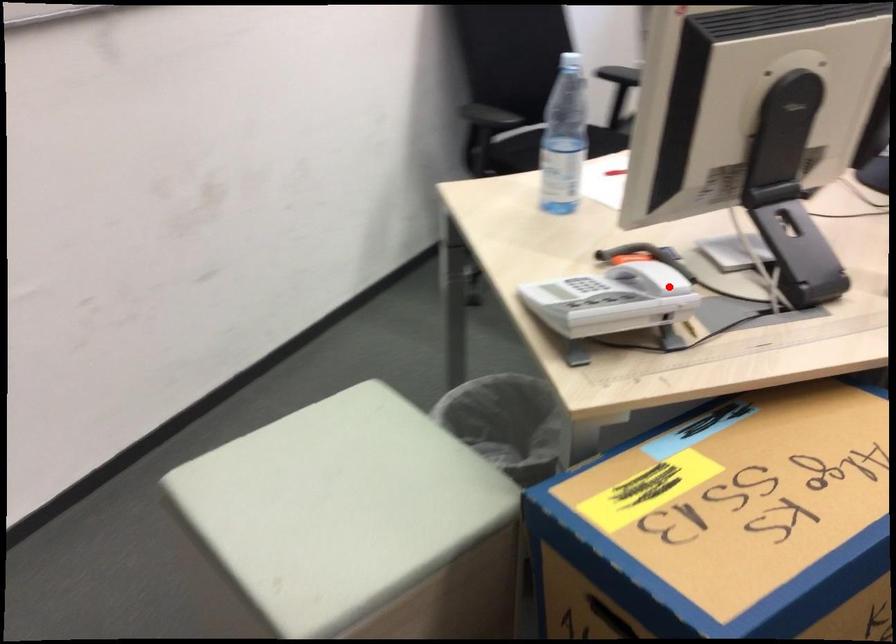
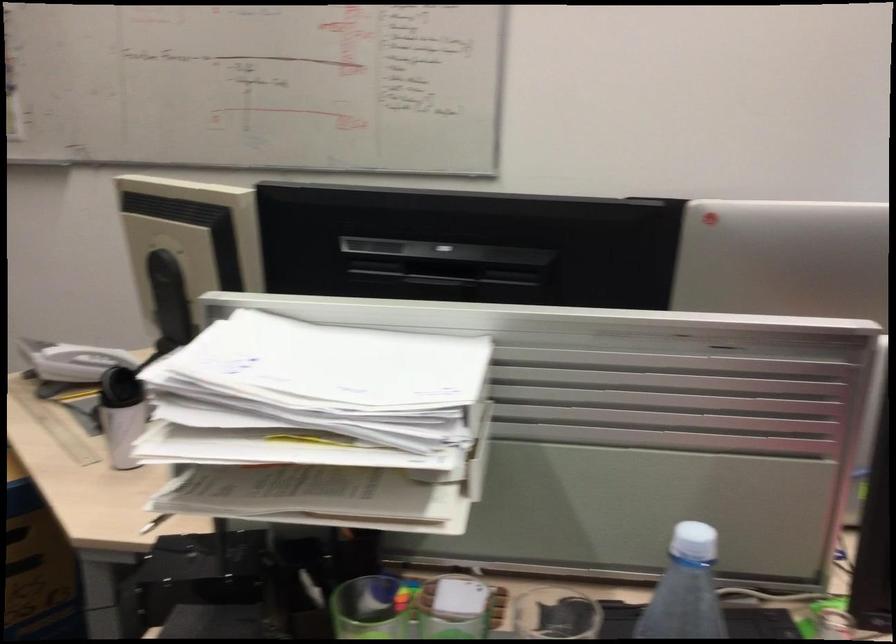
Question: I am providing you with two images of the same scene from different viewpoints. Image1 has a red point marked. In image2, the corresponding 3D location appears at what relative position? Reply with the corresponding letter.

Choices:
 (A) Closer
 (B) Farther

Answer: (B)